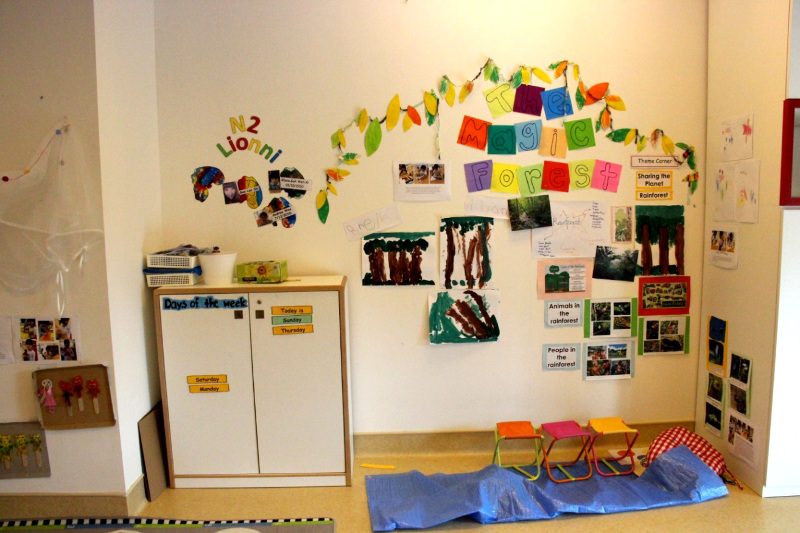
You are a GUI agent. You are given a task and a screenshot of the screen. Output one action in this format:
    pyautogui.click(x=<x>, y=<y>)
    Task: Click on the cabinet
    Image resolution: width=800 pixels, height=533 pixels.
    Given the screenshot: What is the action you would take?
    pyautogui.click(x=296, y=290)